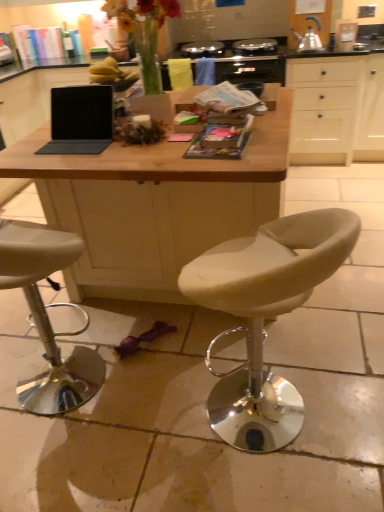
Question: Is white leather stool at center, which is the second chair in left-to-right order, not within printed paper magazine at center, the 2th magazine from the front?

Choices:
 (A) no
 (B) yes

Answer: (B)

Question: Does white leather stool at center, the 1th chair positioned from the right, have a greater width compared to printed paper magazine at center, the second magazine when ordered from bottom to top?

Choices:
 (A) yes
 (B) no

Answer: (A)

Question: Can you confirm if white leather stool at center, the 1th chair positioned from the right, is positioned to the right of printed paper magazine at center, the second magazine when ordered from bottom to top?

Choices:
 (A) yes
 (B) no

Answer: (A)

Question: From a real-world perspective, is white leather stool at center, the 1th chair positioned from the right, below printed paper magazine at center, the second magazine when ordered from bottom to top?

Choices:
 (A) yes
 (B) no

Answer: (A)

Question: Is white leather stool at center, the 1th chair positioned from the right, bigger than printed paper magazine at center, the 2th magazine from the front?

Choices:
 (A) yes
 (B) no

Answer: (A)

Question: Can you confirm if white leather stool at center, which is the second chair in left-to-right order, is taller than printed paper magazine at center, the second magazine when ordered from bottom to top?

Choices:
 (A) no
 (B) yes

Answer: (B)

Question: Is beige leather stool at lower left, the first chair from the left, further to the viewer compared to white leather stool at center, the 1th chair positioned from the right?

Choices:
 (A) no
 (B) yes

Answer: (B)

Question: Is beige leather stool at lower left, which ranks as the second chair in right-to-left order, positioned far away from white leather stool at center, which is the second chair in left-to-right order?

Choices:
 (A) yes
 (B) no

Answer: (B)

Question: Considering the relative sizes of beige leather stool at lower left, which ranks as the second chair in right-to-left order, and white leather stool at center, the 1th chair positioned from the right, in the image provided, is beige leather stool at lower left, which ranks as the second chair in right-to-left order, wider than white leather stool at center, the 1th chair positioned from the right,?

Choices:
 (A) yes
 (B) no

Answer: (B)

Question: From the image's perspective, is beige leather stool at lower left, the first chair from the left, over white leather stool at center, the 1th chair positioned from the right?

Choices:
 (A) no
 (B) yes

Answer: (B)

Question: Is beige leather stool at lower left, the first chair from the left, oriented towards white leather stool at center, which is the second chair in left-to-right order?

Choices:
 (A) yes
 (B) no

Answer: (B)

Question: Can you confirm if beige leather stool at lower left, the first chair from the left, is taller than white leather stool at center, which is the second chair in left-to-right order?

Choices:
 (A) no
 (B) yes

Answer: (B)

Question: Is there a large distance between beige leather stool at lower left, the first chair from the left, and matte black laptop at center?

Choices:
 (A) yes
 (B) no

Answer: (B)